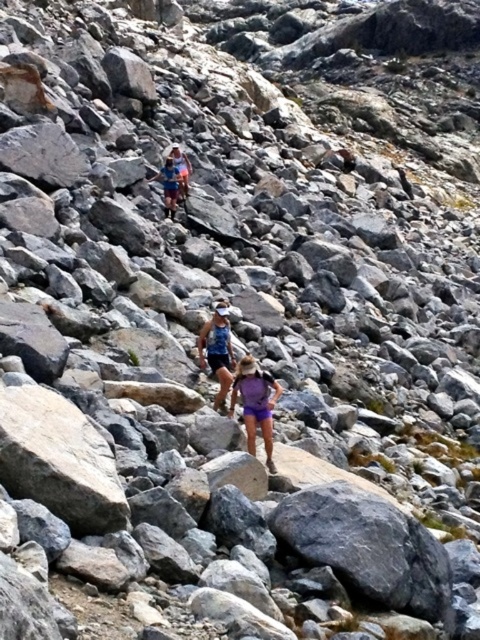
You are a hiker wearing the matte blue tank top at center and blue fabric shorts at center. You need to cross a rocky path ahead. Considering the spatial relationship between your clothing items, which part of your clothing is closer to the ground?

The matte blue tank top at center is below the blue fabric shorts at center, so the tank top is closer to the ground.

Consider the image. You are a hiker trying to decide which item to grab first between the matte blue tank top at center and the matte blue backpack at center. Considering their sizes, which one is easier to reach quickly?

The matte blue tank top at center has a lesser width compared to the matte blue backpack at center, so it is easier to reach quickly due to its smaller size.